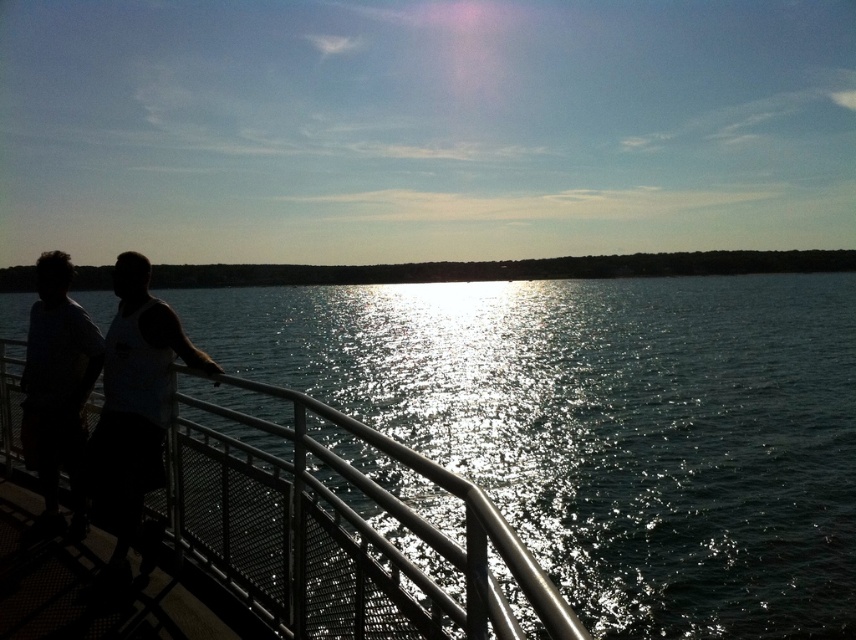
Which is in front, point (504, 634) or point (64, 292)?

Positioned in front is point (504, 634).

Can you confirm if metallic silver rail at center is shorter than matte white shirt at left?

In fact, metallic silver rail at center may be taller than matte white shirt at left.

The image size is (856, 640). Describe the element at coordinates (337, 532) in the screenshot. I see `metallic silver rail at center` at that location.

You are a GUI agent. You are given a task and a screenshot of the screen. Output one action in this format:
    pyautogui.click(x=<x>, y=<y>)
    Task: Click on the metallic silver rail at center
    This screenshot has height=640, width=856.
    Given the screenshot: What is the action you would take?
    pyautogui.click(x=337, y=532)

Does point (134, 385) come behind point (81, 358)?

That is False.

Locate an element on the screen. The width and height of the screenshot is (856, 640). black matte tank top at center is located at coordinates (135, 403).

Image resolution: width=856 pixels, height=640 pixels. Identify the location of black matte tank top at center. (135, 403).

Which of these two, metallic silver rail at center or black matte tank top at center, stands taller?

metallic silver rail at center is taller.

Can you confirm if metallic silver rail at center is positioned above black matte tank top at center?

No, metallic silver rail at center is not above black matte tank top at center.

Identify the location of metallic silver rail at center. This screenshot has width=856, height=640. (337, 532).

Locate an element on the screen. This screenshot has width=856, height=640. metallic silver rail at center is located at coordinates (337, 532).